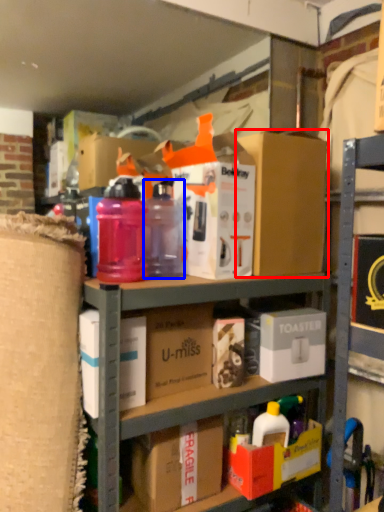
Question: Which point is further to the camera, box (highlighted by a red box) or bottle (highlighted by a blue box)?

Choices:
 (A) box
 (B) bottle

Answer: (A)